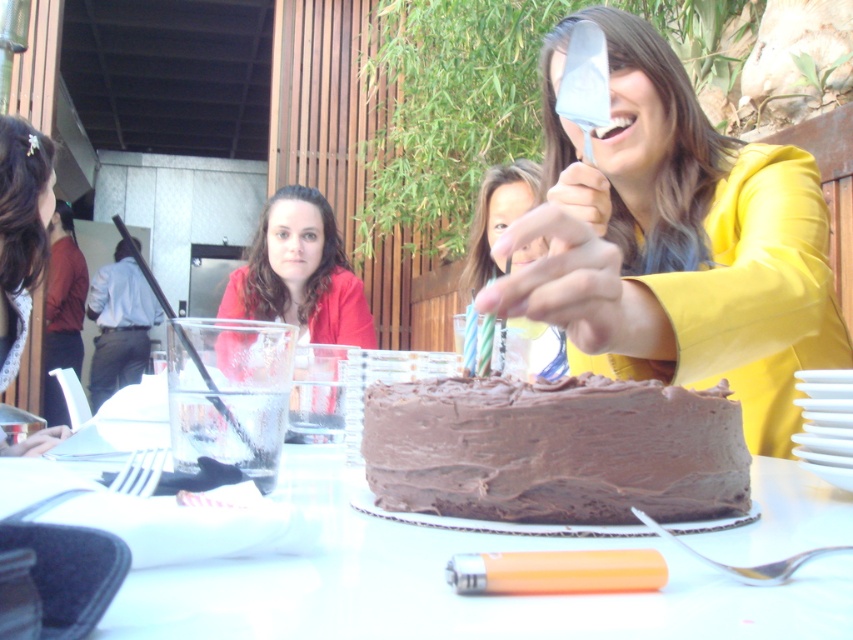
Question: Which of the following is the farthest from the observer?

Choices:
 (A) (419, 413)
 (B) (44, 438)
 (C) (770, 634)
 (D) (289, 269)

Answer: (D)

Question: Does matte red jacket at center have a smaller size compared to matte black hair at left?

Choices:
 (A) yes
 (B) no

Answer: (A)

Question: Which is farther from the chocolate matte cake at center?

Choices:
 (A) matte red jacket at center
 (B) smooth skin face at center
 (C) yellow matte jacket at upper right

Answer: (A)

Question: Among these points, which one is farthest from the camera?

Choices:
 (A) (35, 193)
 (B) (518, 204)
 (C) (305, 502)
 (D) (344, 326)

Answer: (D)

Question: Is smooth white table at center to the right of smooth skin face at center from the viewer's perspective?

Choices:
 (A) no
 (B) yes

Answer: (A)

Question: Does smooth white table at center appear on the left side of chocolate matte cake at center?

Choices:
 (A) no
 (B) yes

Answer: (B)